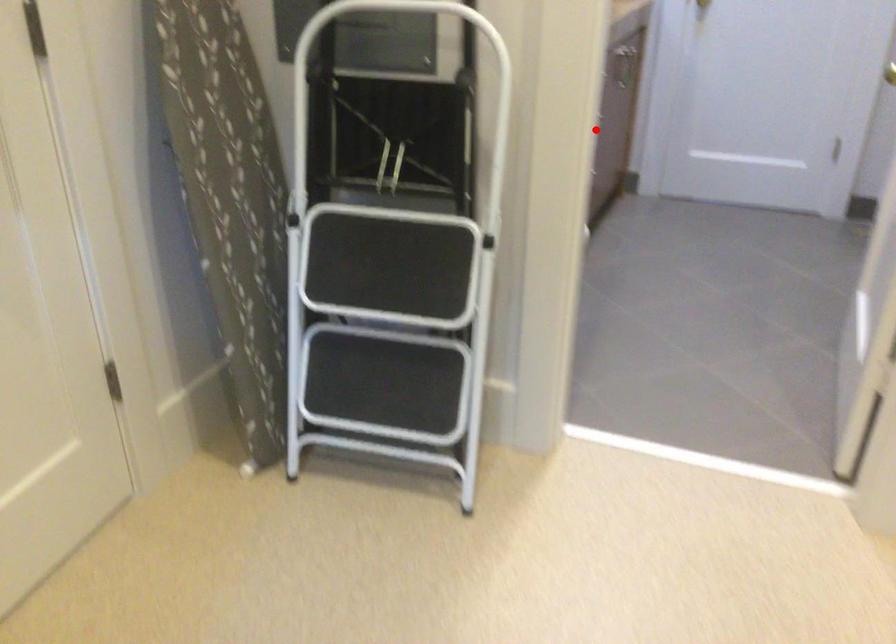
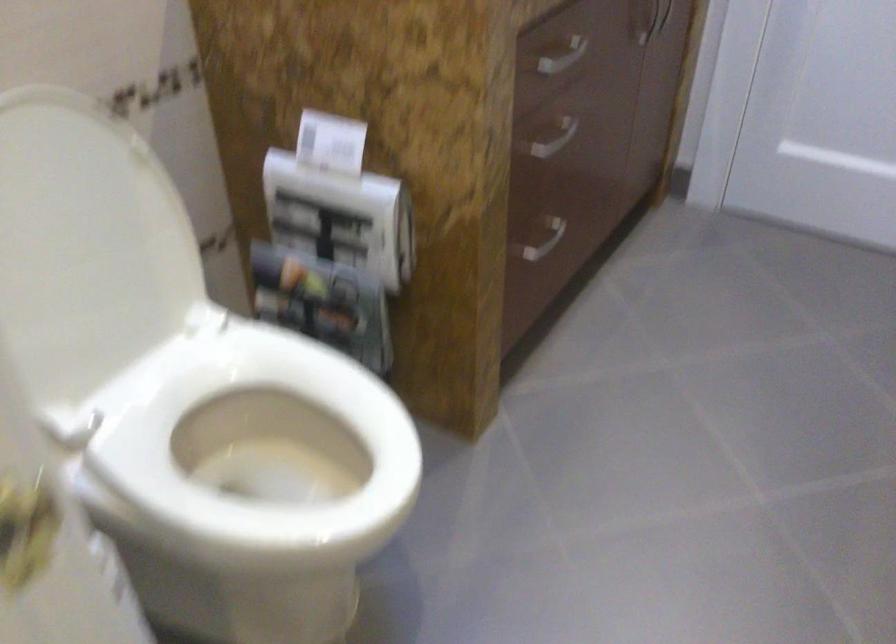
Locate, in the second image, the point that corresponds to the highlighted location in the first image.

(554, 138)